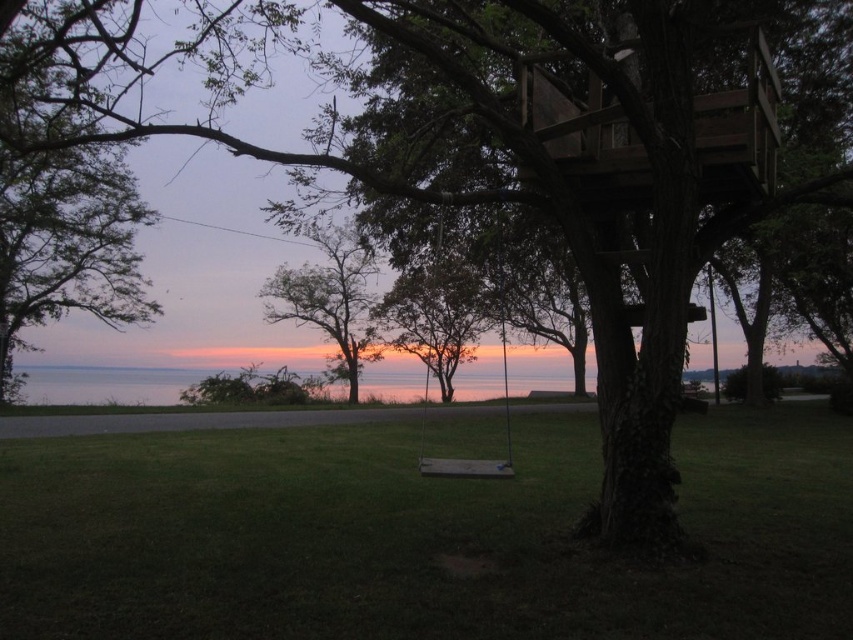
You are planning to take a photo of the green leafy tree at center and the wooden swing at center from the left side of the scene. Which object will appear wider in your photo?

The green leafy tree at center will appear wider in the photo because its width surpasses that of the wooden swing at center.

You are standing in the outdoor scene and want to walk from point (x=321, y=294) to point (x=380, y=326). Which direction should you face to move towards the point that is closer to the camera?

You should face towards point (x=380, y=326) because it is further to the camera than point (x=321, y=294), so moving towards it would mean going away from the camera. Wait, the question is about moving towards the point that is closer to the camera. Since point (x=321, y=294) is closer to the camera, you should face towards it. Hmm, maybe I need to rephrase. Let me check the description again. The description says point (x=380, y=326) is further than point (x=321, y=294). So point 0.461 is closer. The question asks,

You are standing on the green grass at center and want to walk to the green leafy tree at center. How far will you have to walk?

The distance between the green grass at center and the green leafy tree at center is 54.84 feet, so you will have to walk 54.84 feet to reach the tree.